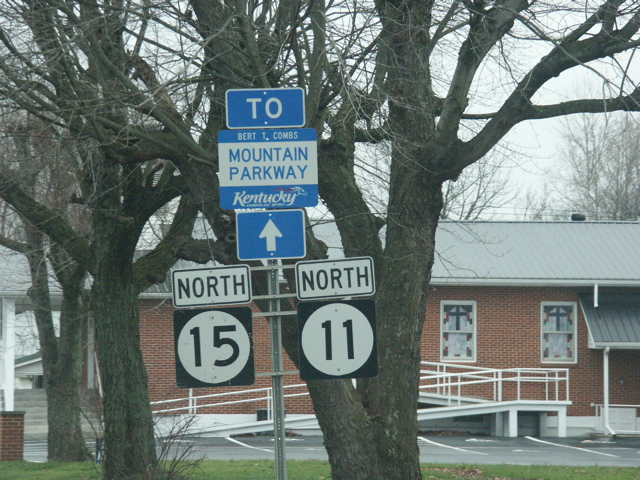
Where is `windows`? The width and height of the screenshot is (640, 480). windows is located at coordinates (566, 333), (459, 339).